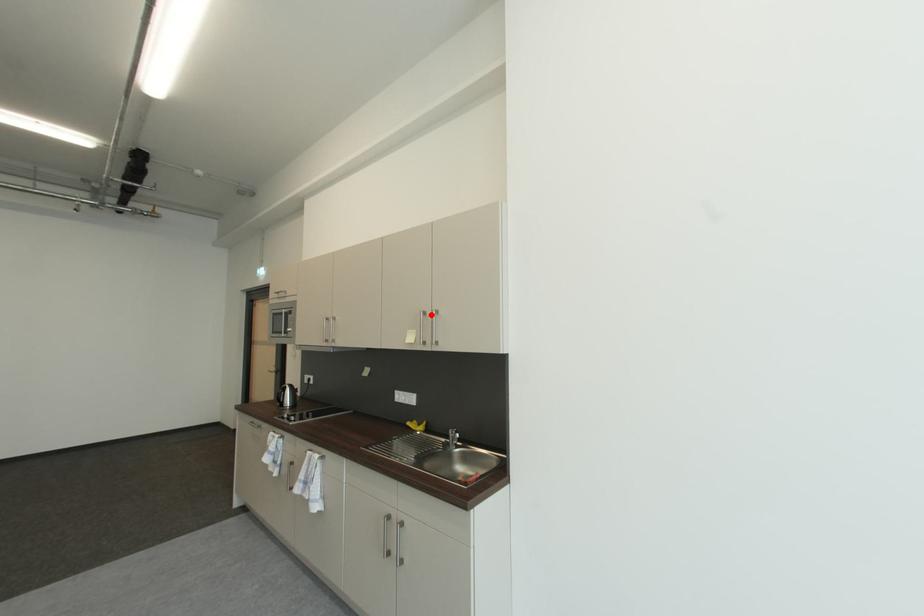
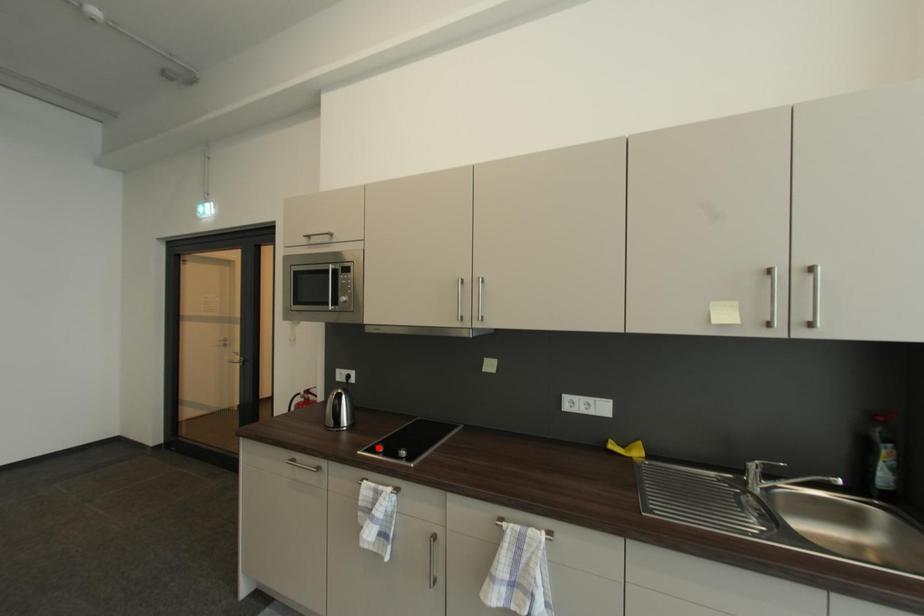
I am providing you with two images of the same scene from different viewpoints. A red point is marked on the first image and another point is marked on the second image. Do the highlighted points in image1 and image2 indicate the same real-world spot?

No